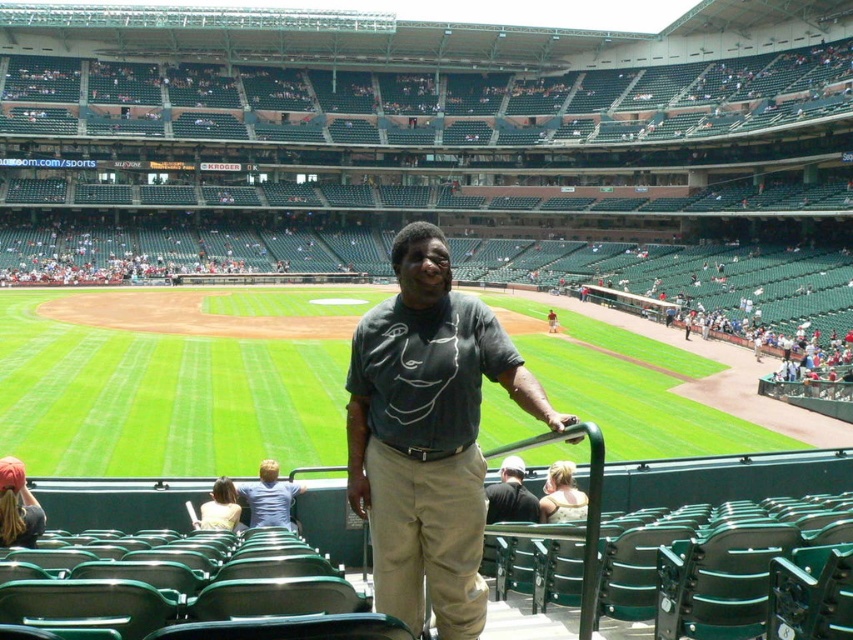
Question: Can you confirm if dark gray t-shirt at center is wider than dark gray shirt at center?

Choices:
 (A) yes
 (B) no

Answer: (A)

Question: Is light blue shirt at center positioned before matte gray shirt at center?

Choices:
 (A) yes
 (B) no

Answer: (A)

Question: Among these objects, which one is nearest to the camera?

Choices:
 (A) matte gray shirt at center
 (B) dark gray t-shirt at center

Answer: (B)

Question: Which point appears closest to the camera in this image?

Choices:
 (A) (274, 483)
 (B) (554, 321)
 (C) (494, 490)
 (D) (419, 412)

Answer: (D)

Question: Based on their relative distances, which object is nearer to the dark gray t-shirt at center?

Choices:
 (A) dark gray shirt at center
 (B) light blue shirt at center
 (C) matte gray shirt at center

Answer: (A)

Question: Can you confirm if light blue shirt at center is bigger than matte gray shirt at center?

Choices:
 (A) yes
 (B) no

Answer: (B)